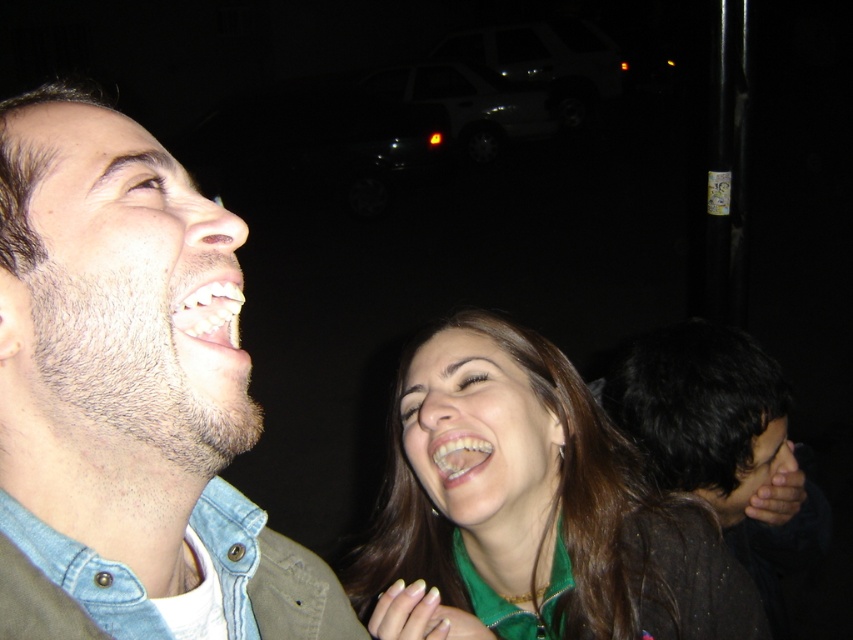
Question: Which of the following is the farthest from the observer?

Choices:
 (A) white glossy teeth at center
 (B) white glossy teeth at lower left

Answer: (A)

Question: Is dark brown hair at lower right closer to camera compared to white glossy teeth at lower left?

Choices:
 (A) yes
 (B) no

Answer: (B)

Question: Among these points, which one is nearest to the camera?

Choices:
 (A) (132, 141)
 (B) (428, 508)
 (C) (207, 321)

Answer: (C)

Question: Is denim jacket at left closer to the viewer compared to dark brown hair at lower right?

Choices:
 (A) no
 (B) yes

Answer: (B)

Question: Observing the image, what is the correct spatial positioning of denim jacket at left in reference to white glossy teeth at center?

Choices:
 (A) below
 (B) above

Answer: (B)

Question: Which object is positioned farthest from the denim jacket at left?

Choices:
 (A) white glossy teeth at center
 (B) white glossy teeth at lower left

Answer: (A)